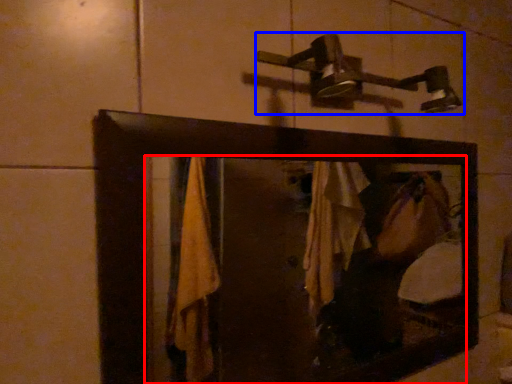
Question: Which object is further to the camera taking this photo, mirror (highlighted by a red box) or shower (highlighted by a blue box)?

Choices:
 (A) mirror
 (B) shower

Answer: (B)